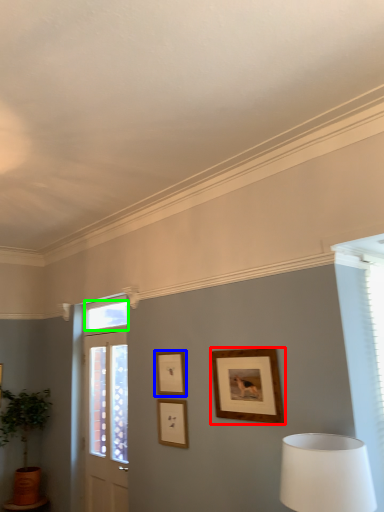
Question: Based on their relative distances, which object is nearer to picture frame (highlighted by a red box)? Choose from picture frame (highlighted by a blue box) and window (highlighted by a green box).

Choices:
 (A) picture frame
 (B) window

Answer: (A)